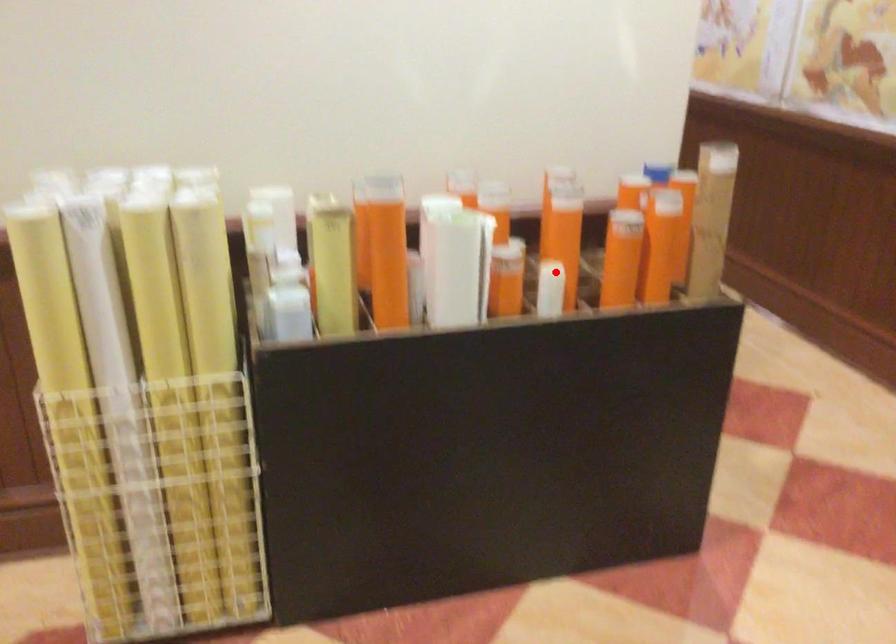
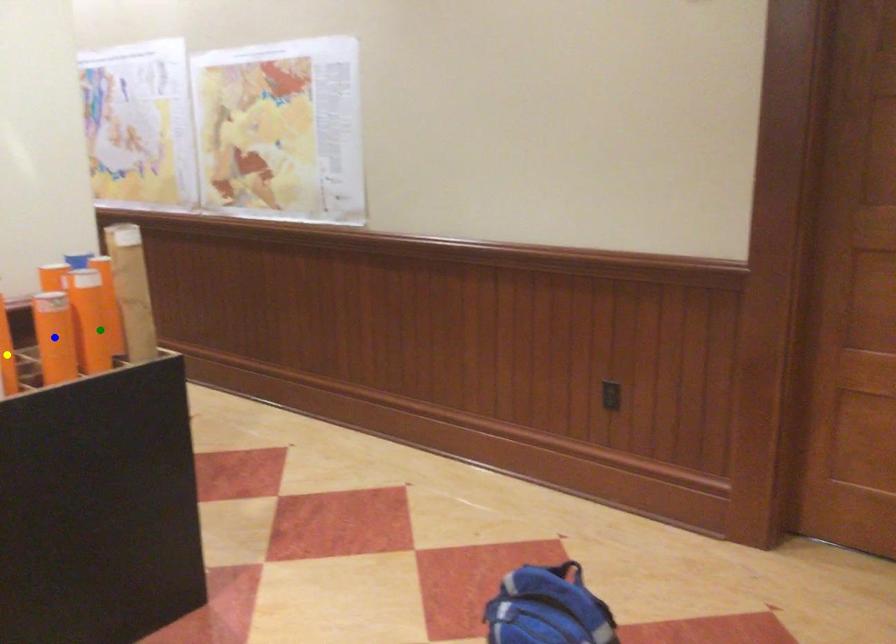
Question: I am providing you with two images of the same scene from different viewpoints. A red point is marked on the first image. You are given multiple points on the second image. Which point in image 2 represents the same 3d spot as the red point in image 1?

Choices:
 (A) blue point
 (B) yellow point
 (C) green point

Answer: (B)